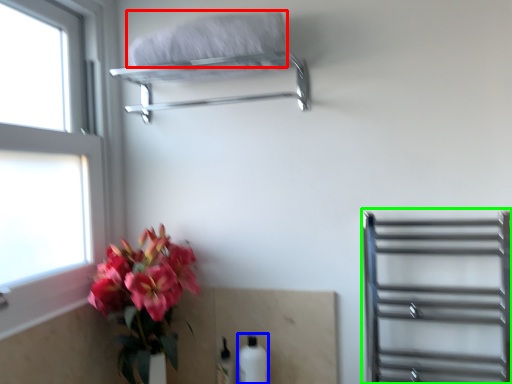
Question: Based on their relative distances, which object is nearer to bath towel (highlighted by a red box)? Choose from bottle (highlighted by a blue box) and shelf (highlighted by a green box).

Choices:
 (A) bottle
 (B) shelf

Answer: (B)